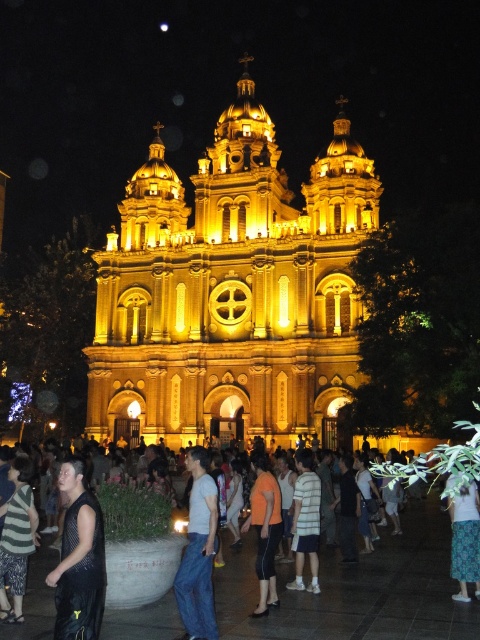
Question: Observing the image, what is the correct spatial positioning of orange cotton shirt at center in reference to striped cotton shirt at center?

Choices:
 (A) below
 (B) above

Answer: (A)

Question: Which of the following is the farthest from the observer?

Choices:
 (A) coord(235,352)
 (B) coord(203,467)
 (C) coord(464,547)

Answer: (A)

Question: Can you confirm if blue jeans at center is positioned above orange cotton shirt at center?

Choices:
 (A) yes
 (B) no

Answer: (A)

Question: Which is farther from the striped cotton shirt at center?

Choices:
 (A) striped fabric dress at lower left
 (B) black mesh tank top at lower left
 (C) blue jeans at center
 (D) golden stone church at center

Answer: (D)

Question: Among these objects, which one is farthest from the camera?

Choices:
 (A) golden stone church at center
 (B) blue jeans at center

Answer: (A)

Question: Is black mesh tank top at lower left thinner than printed cotton skirt at lower right?

Choices:
 (A) no
 (B) yes

Answer: (A)